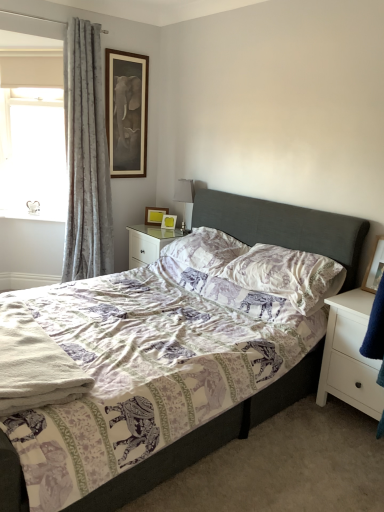
What is the approximate height of silver metallic table lamp at upper center?

It is 19.50 inches.

Locate an element on the screen. white soft towel at lower left is located at coordinates (33, 362).

Measure the distance between point (320, 357) and camera.

Point (320, 357) and camera are 2.44 meters apart.

In order to click on white matte nightstand at right, positioned as the first nightstand in front-to-back order in this screenshot , I will do `click(350, 355)`.

Describe the element at coordinates (350, 355) in the screenshot. The width and height of the screenshot is (384, 512). I see `white matte nightstand at right, marked as the second nightstand in a left-to-right arrangement` at that location.

What do you see at coordinates (148, 243) in the screenshot? The height and width of the screenshot is (512, 384). I see `white glossy nightstand at center, marked as the second nightstand in a right-to-left arrangement` at bounding box center [148, 243].

Where is `wooden picture frame at upper center, the 3th picture frame positioned from the bottom`? This screenshot has width=384, height=512. wooden picture frame at upper center, the 3th picture frame positioned from the bottom is located at coordinates (155, 215).

Consider the image. From the image's perspective, who appears lower, silver metallic table lamp at upper center or purple printed pillow at center, arranged as the second pillow when viewed from the front?

purple printed pillow at center, arranged as the second pillow when viewed from the front, appears lower in the image.

Considering the sizes of silver metallic table lamp at upper center and purple printed pillow at center, which ranks as the 1th pillow in back-to-front order, in the image, is silver metallic table lamp at upper center wider or thinner than purple printed pillow at center, which ranks as the 1th pillow in back-to-front order,?

In the image, silver metallic table lamp at upper center appears to be more narrow than purple printed pillow at center, which ranks as the 1th pillow in back-to-front order.

Is silver metallic table lamp at upper center inside or outside of purple printed pillow at center, which ranks as the 1th pillow in back-to-front order?

silver metallic table lamp at upper center is located beyond the bounds of purple printed pillow at center, which ranks as the 1th pillow in back-to-front order.

Is silver metallic table lamp at upper center beside purple printed pillow at center, which ranks as the 1th pillow in back-to-front order?

They are not placed beside each other.

Is gray velvet curtain at left inside the boundaries of printed fabric pillow at center, which is the 2th pillow in back-to-front order, or outside?

gray velvet curtain at left is spatially situated outside printed fabric pillow at center, which is the 2th pillow in back-to-front order.

The image size is (384, 512). In order to click on pillow that is the 1st one below the gray velvet curtain at left (from a real-world perspective) in this screenshot , I will do `click(287, 275)`.

Can you confirm if gray velvet curtain at left is smaller than printed fabric pillow at center, which is the 2th pillow in back-to-front order?

No, gray velvet curtain at left is not smaller than printed fabric pillow at center, which is the 2th pillow in back-to-front order.

Is gray velvet curtain at left oriented towards printed fabric pillow at center, the first pillow when ordered from front to back?

Yes.

Image resolution: width=384 pixels, height=512 pixels. Identify the location of the 2nd pillow positioned below the silver metallic table lamp at upper center (from the image's perspective). (287, 275).

How distant is silver metallic table lamp at upper center from printed fabric pillow at center, the first pillow when ordered from front to back?

The distance of silver metallic table lamp at upper center from printed fabric pillow at center, the first pillow when ordered from front to back, is 1.19 meters.

From the image's perspective, which is below, silver metallic table lamp at upper center or printed fabric pillow at center, which is the 2th pillow in back-to-front order?

printed fabric pillow at center, which is the 2th pillow in back-to-front order, from the image's perspective.

Which point is more forward, (187, 196) or (317, 260)?

The point (317, 260) is closer to the camera.

You are a GUI agent. You are given a task and a screenshot of the screen. Output one action in this format:
    pyautogui.click(x=<x>, y=<y>)
    Task: Click on the table lamp that appears on the right of white fabric at upper left
    The width and height of the screenshot is (384, 512).
    Given the screenshot: What is the action you would take?
    pyautogui.click(x=184, y=191)

Is silver metallic table lamp at upper center facing towards white fabric at upper left?

No.

Relative to white fabric at upper left, is silver metallic table lamp at upper center in front or behind?

silver metallic table lamp at upper center is positioned closer to the viewer than white fabric at upper left.

Are silver metallic table lamp at upper center and white fabric at upper left located far from each other?

That's right, there is a large distance between silver metallic table lamp at upper center and white fabric at upper left.

Considering the sizes of objects wooden picture frame at upper center, which is the second picture frame in left-to-right order, and purple printed pillow at center, arranged as the second pillow when viewed from the front, in the image provided, who is bigger, wooden picture frame at upper center, which is the second picture frame in left-to-right order, or purple printed pillow at center, arranged as the second pillow when viewed from the front,?

purple printed pillow at center, arranged as the second pillow when viewed from the front.

Who is more distant, wooden picture frame at upper center, the first picture frame positioned from the back, or purple printed pillow at center, which ranks as the 1th pillow in back-to-front order?

wooden picture frame at upper center, the first picture frame positioned from the back, is further away from the camera.

Between wooden picture frame at right, which is counted as the 1th picture frame, starting from the bottom, and printed fabric pillow at center, which is the 2th pillow in back-to-front order, which one appears on the left side from the viewer's perspective?

Positioned to the left is printed fabric pillow at center, which is the 2th pillow in back-to-front order.

Is wooden picture frame at right, marked as the 4th picture frame in a back-to-front arrangement, closer to camera compared to printed fabric pillow at center, which is the 2th pillow in back-to-front order?

No, the depth of wooden picture frame at right, marked as the 4th picture frame in a back-to-front arrangement, is greater than that of printed fabric pillow at center, which is the 2th pillow in back-to-front order.

Can you tell me how much wooden picture frame at right, arranged as the fourth picture frame when viewed from the top, and printed fabric pillow at center, the first pillow when ordered from front to back, differ in facing direction?

The angular difference between wooden picture frame at right, arranged as the fourth picture frame when viewed from the top, and printed fabric pillow at center, the first pillow when ordered from front to back, is 1.46 degrees.

Considering the points (367, 272) and (239, 270), which point is in front, point (367, 272) or point (239, 270)?

The point (367, 272) is closer.

Is the depth of purple printed pillow at center, which ranks as the 1th pillow in back-to-front order, greater than that of white matte nightstand at right, marked as the second nightstand in a left-to-right arrangement?

Yes, it is behind white matte nightstand at right, marked as the second nightstand in a left-to-right arrangement.

Does point (204, 263) appear closer or farther from the camera than point (355, 316)?

Point (204, 263).

How different are the orientations of purple printed pillow at center, arranged as the second pillow when viewed from the front, and white matte nightstand at right, the 2th nightstand from the top, in degrees?

They differ by 1.46 degrees in their facing directions.

Which of these two, purple printed pillow at center, arranged as the second pillow when viewed from the front, or white matte nightstand at right, marked as the second nightstand in a left-to-right arrangement, is wider?

Wider between the two is white matte nightstand at right, marked as the second nightstand in a left-to-right arrangement.

This screenshot has width=384, height=512. I want to click on the 1st pillow in front of the silver metallic table lamp at upper center, so click(x=205, y=249).

You are a GUI agent. You are given a task and a screenshot of the screen. Output one action in this format:
    pyautogui.click(x=<x>, y=<y>)
    Task: Click on the curtain above the printed fabric pillow at center, the first pillow when ordered from front to back (from the image's perspective)
    This screenshot has height=512, width=384.
    Given the screenshot: What is the action you would take?
    pyautogui.click(x=86, y=157)

When comparing their distances from printed fabric pillow at center, which is the 2th pillow in back-to-front order, does white soft towel at lower left or matte wooden picture frame at upper center, which is counted as the 4th picture frame, starting from the right, seem closer?

white soft towel at lower left lies closer to printed fabric pillow at center, which is the 2th pillow in back-to-front order, than the other object.

When comparing their distances from white glossy nightstand at center, the first nightstand positioned from the top, does gray velvet curtain at left or patterned fabric bed at center seem further?

gray velvet curtain at left lies further to white glossy nightstand at center, the first nightstand positioned from the top, than the other object.

Based on the photo, when comparing their distances from patterned fabric bed at center, does wooden picture frame at upper center, which is the second picture frame in left-to-right order, or white matte nightstand at right, positioned as the first nightstand in right-to-left order, seem further?

wooden picture frame at upper center, which is the second picture frame in left-to-right order, lies further to patterned fabric bed at center than the other object.

Looking at the image, which one is located closer to gray velvet curtain at left, white soft towel at lower left or white glossy nightstand at center, which ranks as the second nightstand in front-to-back order?

white glossy nightstand at center, which ranks as the second nightstand in front-to-back order, lies closer to gray velvet curtain at left than the other object.

Considering their positions, is wooden picture frame at upper center, which is the third picture frame from right to left, positioned further to white soft towel at lower left than white fabric at upper left?

Based on the image, white fabric at upper left appears to be further to white soft towel at lower left.

Based on their spatial positions, is silver metallic table lamp at upper center or white soft towel at lower left closer to white glossy nightstand at center, the first nightstand positioned from the top?

silver metallic table lamp at upper center is positioned closer to the anchor white glossy nightstand at center, the first nightstand positioned from the top.

Considering their positions, is wooden picture frame at right, arranged as the fourth picture frame when viewed from the top, positioned closer to matte wooden picture frame at upper center, arranged as the 1th picture frame when viewed from the left, than white fabric at upper left?

white fabric at upper left.

From the image, which object appears to be nearer to white fabric at upper left, silver metallic table lamp at upper center or gray velvet curtain at left?

Based on the image, gray velvet curtain at left appears to be nearer to white fabric at upper left.

Where is `table lamp located between printed fabric pillow at center, the first pillow when ordered from front to back, and wooden picture frame at upper center, arranged as the 2th picture frame when viewed from the back, in the depth direction`? The height and width of the screenshot is (512, 384). table lamp located between printed fabric pillow at center, the first pillow when ordered from front to back, and wooden picture frame at upper center, arranged as the 2th picture frame when viewed from the back, in the depth direction is located at coordinates click(x=184, y=191).

The width and height of the screenshot is (384, 512). Find the location of `nightstand between purple printed pillow at center, arranged as the second pillow when viewed from the front, and wooden picture frame at upper center, which is the second picture frame in left-to-right order, in the front-back direction`. nightstand between purple printed pillow at center, arranged as the second pillow when viewed from the front, and wooden picture frame at upper center, which is the second picture frame in left-to-right order, in the front-back direction is located at coordinates (148, 243).

Where is `table lamp between gray velvet curtain at left and wooden picture frame at upper center, which appears as the second picture frame when viewed from the top, along the z-axis`? table lamp between gray velvet curtain at left and wooden picture frame at upper center, which appears as the second picture frame when viewed from the top, along the z-axis is located at coordinates (184, 191).

Where is `nightstand between white fabric at upper left and silver metallic table lamp at upper center in the horizontal direction`? The width and height of the screenshot is (384, 512). nightstand between white fabric at upper left and silver metallic table lamp at upper center in the horizontal direction is located at coordinates (148, 243).